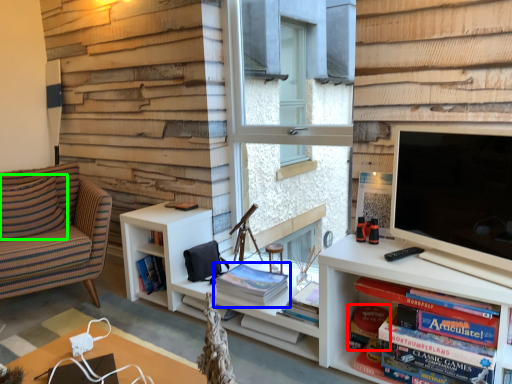
Question: Which object is the closest to the paperback book (highlighted by a red box)? Choose among these: book (highlighted by a blue box) or pillow (highlighted by a green box).

Choices:
 (A) book
 (B) pillow

Answer: (A)